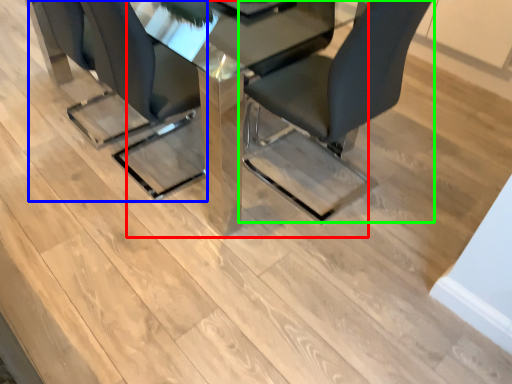
Question: Considering the real-world distances, which object is farthest from table (highlighted by a red box)? chair (highlighted by a blue box) or chair (highlighted by a green box)?

Choices:
 (A) chair
 (B) chair

Answer: (A)